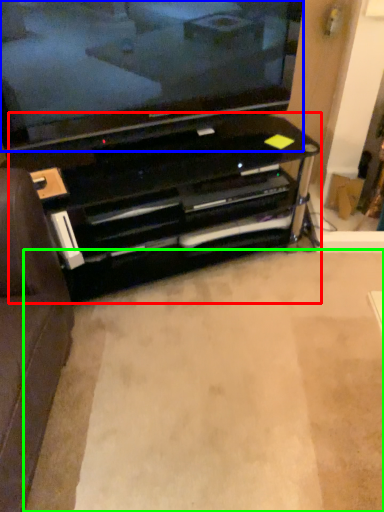
Question: Estimate the real-world distances between objects in this image. Which object is farther from entertainment center (highlighted by a red box), television (highlighted by a blue box) or plain (highlighted by a green box)?

Choices:
 (A) television
 (B) plain

Answer: (B)